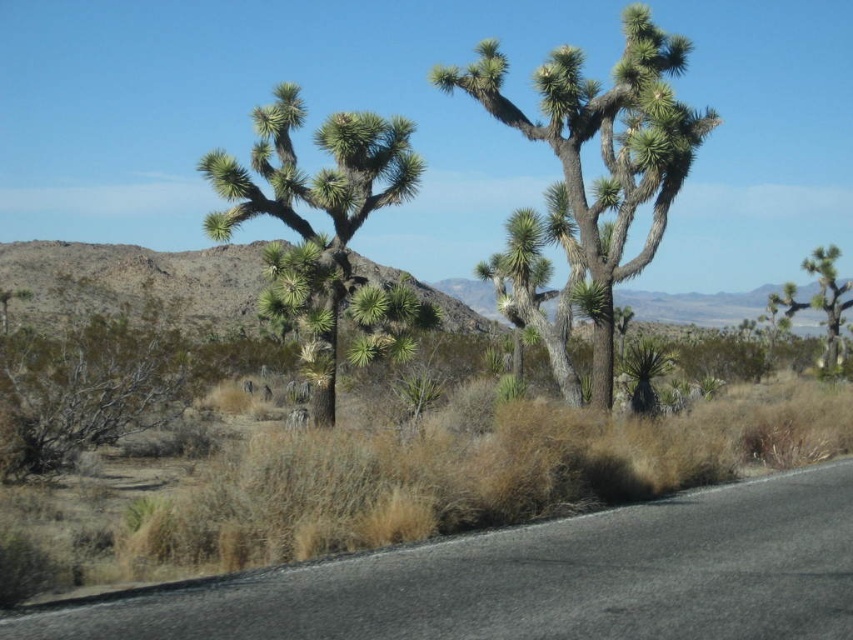
You are a desert explorer who wants to place a GPS marker exactly at the center of the desert scene. The GPS coordinates are given as a grid from 0 to 1 in both x and y directions. You see the green spiky cactus at center. Can you determine if the cactus is located at the exact center of the desert scene?

The green spiky cactus at center is located at position point (602, 150). The exact center of the desert scene would be at coordinates (426, 320). Since the cactus is not at (426, 320), it is not located at the exact center of the desert scene.

You are a hiker who wants to take a photo of both the green spiky plant at center and the green spiky cactus at right. Which one should you focus on first to ensure both are in the frame?

You should focus on the green spiky plant at center first because it is above the green spiky cactus at right, so adjusting the camera angle to include both would require framing from the higher object downward.